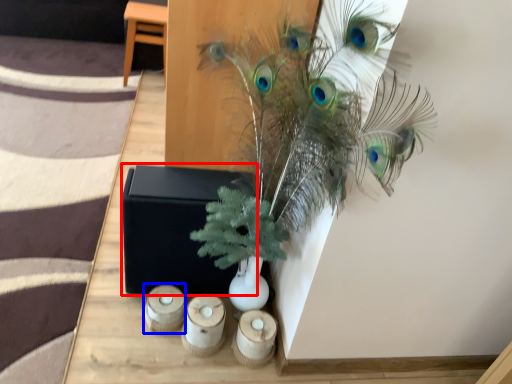
Question: Which of the following is the farthest to the observer, box (highlighted by a red box) or candle holder (highlighted by a blue box)?

Choices:
 (A) box
 (B) candle holder

Answer: (B)